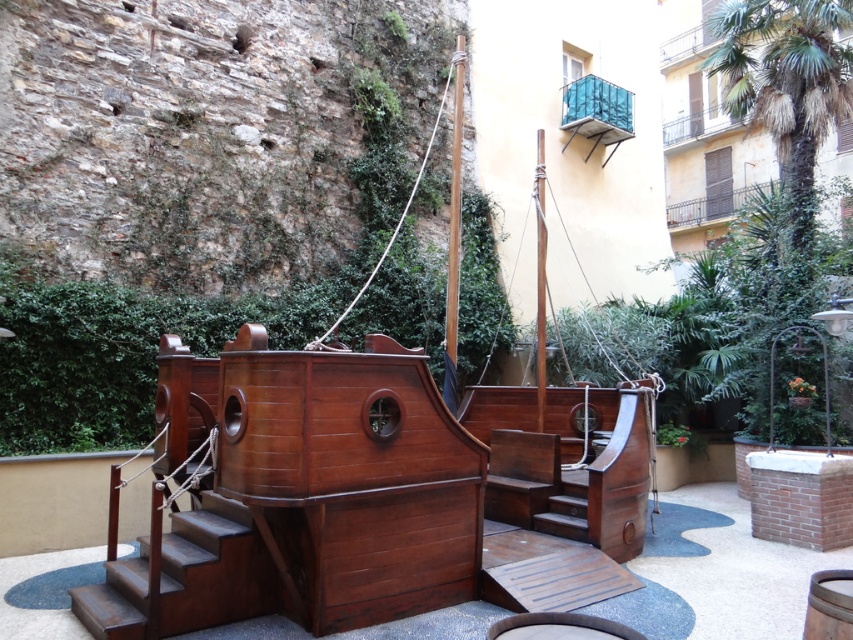
Question: Which point is farther to the camera?

Choices:
 (A) (215, 392)
 (B) (218, 563)

Answer: (A)

Question: Which point is farther to the camera?

Choices:
 (A) wooden mast at upper center
 (B) shiny brown wooden boat at center
 (C) shiny brown wood stairs at lower left

Answer: (A)

Question: Is shiny brown wooden boat at center to the left of green leafy palm tree at upper right from the viewer's perspective?

Choices:
 (A) yes
 (B) no

Answer: (A)

Question: Is green leafy palm tree at upper right to the right of smooth brown mast at center from the viewer's perspective?

Choices:
 (A) no
 (B) yes

Answer: (B)

Question: Is shiny brown wood stairs at lower left further to the viewer compared to wooden mast at upper center?

Choices:
 (A) no
 (B) yes

Answer: (A)

Question: Which object is farther from the camera taking this photo?

Choices:
 (A) smooth brown mast at center
 (B) wooden mast at upper center

Answer: (A)